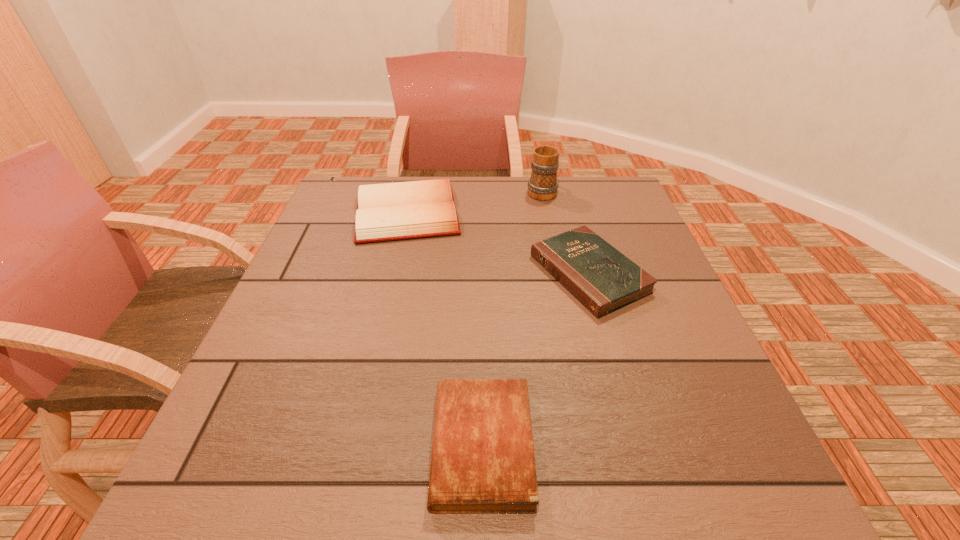
Where is `mug`? This screenshot has width=960, height=540. mug is located at coordinates (542, 185).

I want to click on the rightmost Bible, so (601, 278).

Locate an element on the screen. the nearest Bible is located at coordinates (482, 462).

I want to click on vacant space located 0.200m on the front of the rightmost Bible, so click(625, 401).

The height and width of the screenshot is (540, 960). Identify the location of vacant space situated on the spine side of the nearest object. (276, 446).

Locate an element on the screen. Image resolution: width=960 pixels, height=540 pixels. vacant space located on the spine side of the nearest object is located at coordinates (324, 446).

Image resolution: width=960 pixels, height=540 pixels. I want to click on vacant area situated 0.090m on the spine side of the nearest object, so (379, 446).

At what (x,y) coordinates should I click in order to perform the action: click on mug that is at the far edge. Please return your answer as a coordinate pair (x, y). Looking at the image, I should click on (542, 185).

This screenshot has height=540, width=960. I want to click on Bible located at the far edge, so click(x=404, y=210).

The image size is (960, 540). Find the location of `object that is at the near edge`. object that is at the near edge is located at coordinates (482, 462).